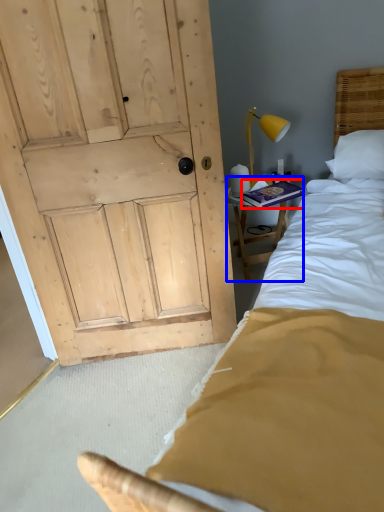
Question: Among these objects, which one is farthest to the camera, book (highlighted by a red box) or furniture (highlighted by a blue box)?

Choices:
 (A) book
 (B) furniture

Answer: (B)